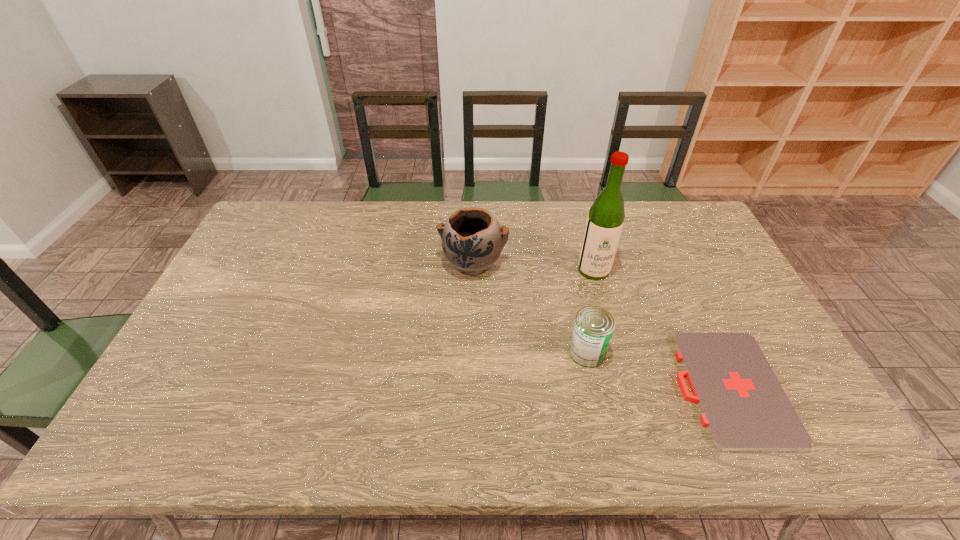
In the image, there is a desktop. What are the coordinates of `vacant space at the near right corner` in the screenshot? It's located at (827, 438).

You are a GUI agent. You are given a task and a screenshot of the screen. Output one action in this format:
    pyautogui.click(x=<x>, y=<y>)
    Task: Click on the free point between the pottery and the tallest object
    Image resolution: width=960 pixels, height=540 pixels.
    Given the screenshot: What is the action you would take?
    pyautogui.click(x=533, y=266)

The image size is (960, 540). In order to click on unoccupied position between the second tallest object and the liquor in this screenshot , I will do `click(533, 266)`.

I want to click on free space between the liquor and the rightmost object, so click(661, 329).

The image size is (960, 540). Identify the location of vacant area that lies between the tallest object and the shortest object. (661, 329).

The image size is (960, 540). In order to click on free space between the rightmost object and the liquor in this screenshot , I will do `click(661, 329)`.

Where is `empty space between the second tallest object and the second shortest object`? This screenshot has width=960, height=540. empty space between the second tallest object and the second shortest object is located at coordinates (530, 307).

Find the location of a particular element. The image size is (960, 540). vacant area that lies between the liquor and the rightmost object is located at coordinates (661, 329).

Identify the location of vacant point located between the tallest object and the first-aid kit. pos(661,329).

Where is `unoccupied position between the can and the second tallest object`? The width and height of the screenshot is (960, 540). unoccupied position between the can and the second tallest object is located at coordinates (530, 307).